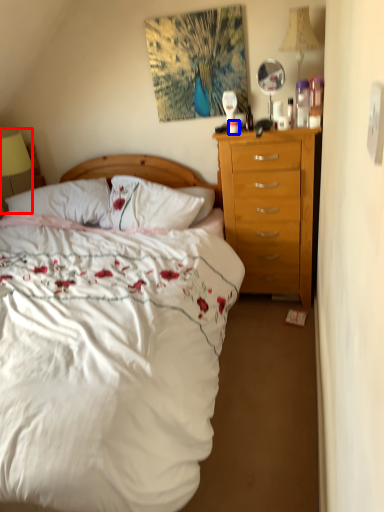
Question: Which object is further to the camera taking this photo, lamp (highlighted by a red box) or coffee cup (highlighted by a blue box)?

Choices:
 (A) lamp
 (B) coffee cup

Answer: (A)